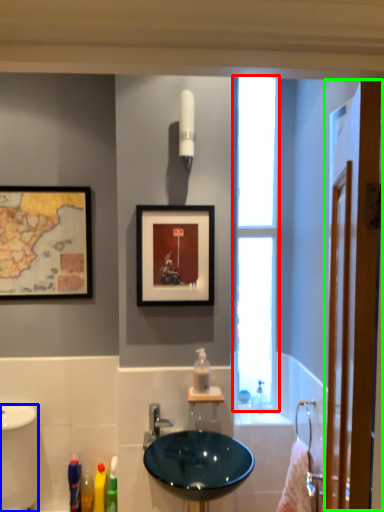
Question: Which object is positioned closest to window (highlighted by a red box)? Select from bidet (highlighted by a blue box) and screen door (highlighted by a green box).

Choices:
 (A) bidet
 (B) screen door

Answer: (A)